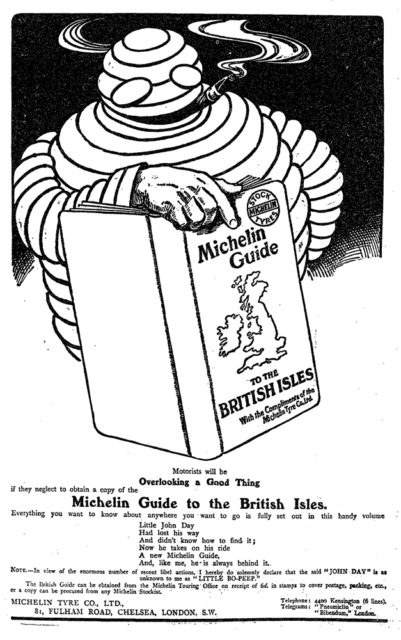
I want to click on book, so click(180, 269).